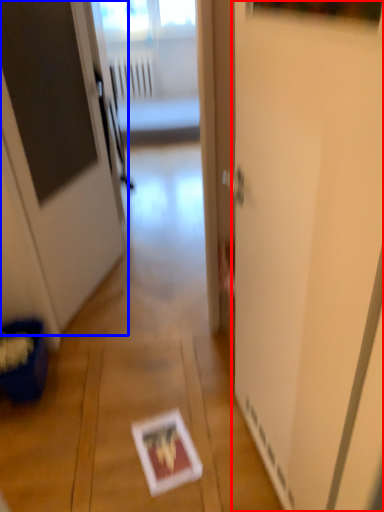
Question: Which of the following is the closest to the observer, screen door (highlighted by a red box) or door (highlighted by a blue box)?

Choices:
 (A) screen door
 (B) door

Answer: (A)